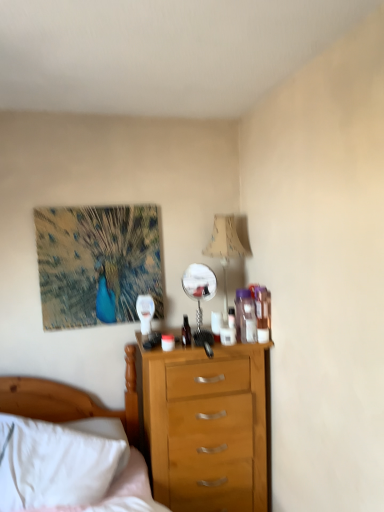
Image resolution: width=384 pixels, height=512 pixels. I want to click on textured canvas peacock at upper left, so click(97, 264).

Image resolution: width=384 pixels, height=512 pixels. What are the coordinates of `polished silver mirror at center` in the screenshot? It's located at (200, 296).

The width and height of the screenshot is (384, 512). What are the coordinates of `textured canvas peacock at upper left` in the screenshot? It's located at (97, 264).

Between textured canvas peacock at upper left and white soft bed at lower left, which one has smaller width?

textured canvas peacock at upper left.

From a real-world perspective, is textured canvas peacock at upper left on white soft bed at lower left?

Indeed, from a real-world perspective, textured canvas peacock at upper left stands above white soft bed at lower left.

Is textured canvas peacock at upper left far from white soft bed at lower left?

textured canvas peacock at upper left is actually quite close to white soft bed at lower left.

Locate an element on the screen. bed on the left of textured canvas peacock at upper left is located at coordinates (70, 448).

Would you say beige fabric lampshade at upper right is outside textured canvas peacock at upper left?

beige fabric lampshade at upper right lies outside textured canvas peacock at upper left's area.

Between beige fabric lampshade at upper right and textured canvas peacock at upper left, which one is positioned behind?

textured canvas peacock at upper left.

How many degrees apart are the facing directions of beige fabric lampshade at upper right and textured canvas peacock at upper left?

There is a 0.599-degree angle between the facing directions of beige fabric lampshade at upper right and textured canvas peacock at upper left.

From a real-world perspective, is beige fabric lampshade at upper right below textured canvas peacock at upper left?

Yes, from a real-world perspective, beige fabric lampshade at upper right is beneath textured canvas peacock at upper left.

Which object is closer to the camera taking this photo, textured canvas peacock at upper left or polished silver mirror at center?

polished silver mirror at center is in front.

Considering the sizes of objects textured canvas peacock at upper left and polished silver mirror at center in the image provided, who is shorter, textured canvas peacock at upper left or polished silver mirror at center?

polished silver mirror at center is shorter.

Does textured canvas peacock at upper left have a lesser width compared to polished silver mirror at center?

Indeed, textured canvas peacock at upper left has a lesser width compared to polished silver mirror at center.

The image size is (384, 512). Find the location of `mirror that appears in front of the textured canvas peacock at upper left`. mirror that appears in front of the textured canvas peacock at upper left is located at coordinates (200, 296).

Is beige fabric lampshade at upper right facing towards white soft bed at lower left?

No, beige fabric lampshade at upper right is not oriented towards white soft bed at lower left.

Visually, is beige fabric lampshade at upper right positioned to the left or to the right of white soft bed at lower left?

Based on their positions, beige fabric lampshade at upper right is located to the right of white soft bed at lower left.

Is polished silver mirror at center oriented towards beige fabric lampshade at upper right?

No, polished silver mirror at center does not turn towards beige fabric lampshade at upper right.

From a real-world perspective, is polished silver mirror at center located beneath beige fabric lampshade at upper right?

Indeed, from a real-world perspective, polished silver mirror at center is positioned beneath beige fabric lampshade at upper right.

Which object is positioned more to the left, polished silver mirror at center or beige fabric lampshade at upper right?

polished silver mirror at center.

From the image's perspective, is polished silver mirror at center below beige fabric lampshade at upper right?

Yes, from the image's perspective, polished silver mirror at center is below beige fabric lampshade at upper right.

How different are the orientations of polished silver mirror at center and textured canvas peacock at upper left in degrees?

polished silver mirror at center and textured canvas peacock at upper left are facing 3.53 degrees away from each other.

Is polished silver mirror at center not near textured canvas peacock at upper left?

No.

Considering the relative sizes of polished silver mirror at center and textured canvas peacock at upper left in the image provided, is polished silver mirror at center taller than textured canvas peacock at upper left?

Incorrect, the height of polished silver mirror at center is not larger of that of textured canvas peacock at upper left.

Which object is closer to the camera taking this photo, polished silver mirror at center or textured canvas peacock at upper left?

polished silver mirror at center is in front.

Can you tell me how much polished silver mirror at center and white soft bed at lower left differ in facing direction?

polished silver mirror at center and white soft bed at lower left are facing 17.8 degrees away from each other.

Is polished silver mirror at center completely or partially outside of white soft bed at lower left?

Yes, polished silver mirror at center is located beyond the bounds of white soft bed at lower left.

In the scene shown: In terms of height, does polished silver mirror at center look taller or shorter compared to white soft bed at lower left?

Clearly, polished silver mirror at center is shorter compared to white soft bed at lower left.

Considering the positions of objects polished silver mirror at center and white soft bed at lower left in the image provided, who is in front, polished silver mirror at center or white soft bed at lower left?

white soft bed at lower left.

Identify the location of picture frame above the white soft bed at lower left (from the image's perspective). The width and height of the screenshot is (384, 512). (97, 264).

I want to click on lamp that appears in front of the textured canvas peacock at upper left, so click(x=225, y=249).

Looking at the image, which one is located closer to textured canvas peacock at upper left, beige fabric lampshade at upper right or polished silver mirror at center?

polished silver mirror at center is closer to textured canvas peacock at upper left.

From the image, which object appears to be farther from textured canvas peacock at upper left, polished silver mirror at center or white soft bed at lower left?

The object further to textured canvas peacock at upper left is white soft bed at lower left.

Looking at this image, from the image, which object appears to be farther from polished silver mirror at center, white soft bed at lower left or beige fabric lampshade at upper right?

white soft bed at lower left is positioned further to the anchor polished silver mirror at center.

Estimate the real-world distances between objects in this image. Which object is closer to white soft bed at lower left, beige fabric lampshade at upper right or polished silver mirror at center?

polished silver mirror at center.

When comparing their distances from white soft bed at lower left, does beige fabric lampshade at upper right or textured canvas peacock at upper left seem further?

beige fabric lampshade at upper right lies further to white soft bed at lower left than the other object.

Estimate the real-world distances between objects in this image. Which object is closer to beige fabric lampshade at upper right, polished silver mirror at center or textured canvas peacock at upper left?

polished silver mirror at center is positioned closer to the anchor beige fabric lampshade at upper right.

Based on their spatial positions, is polished silver mirror at center or beige fabric lampshade at upper right further from textured canvas peacock at upper left?

Among the two, beige fabric lampshade at upper right is located further to textured canvas peacock at upper left.

From the image, which object appears to be farther from polished silver mirror at center, textured canvas peacock at upper left or white soft bed at lower left?

white soft bed at lower left lies further to polished silver mirror at center than the other object.

Find the location of a particular element. lamp between textured canvas peacock at upper left and white soft bed at lower left in the vertical direction is located at coordinates (225, 249).

Where is `mirror between textured canvas peacock at upper left and beige fabric lampshade at upper right from left to right`? This screenshot has height=512, width=384. mirror between textured canvas peacock at upper left and beige fabric lampshade at upper right from left to right is located at coordinates (200, 296).

This screenshot has width=384, height=512. Identify the location of mirror between textured canvas peacock at upper left and white soft bed at lower left vertically. (200, 296).

Where is `mirror between white soft bed at lower left and beige fabric lampshade at upper right from left to right`? mirror between white soft bed at lower left and beige fabric lampshade at upper right from left to right is located at coordinates point(200,296).